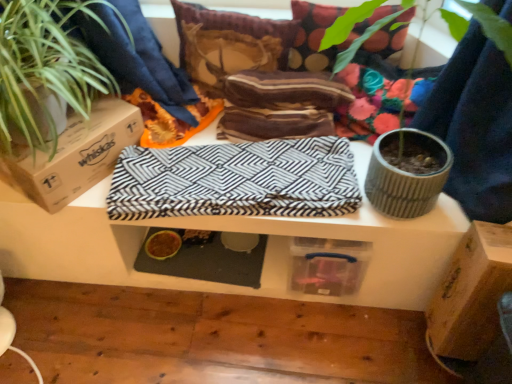
Question: Does green textured plant at upper right come in front of brown cardboard box at left, the second cardboard box ordered from the bottom?

Choices:
 (A) no
 (B) yes

Answer: (B)

Question: From a real-world perspective, is green textured plant at upper right positioned under brown cardboard box at left, the second cardboard box ordered from the bottom, based on gravity?

Choices:
 (A) no
 (B) yes

Answer: (A)

Question: From the image's perspective, is green textured plant at upper right above brown cardboard box at left, marked as the 1th cardboard box in a top-to-bottom arrangement?

Choices:
 (A) yes
 (B) no

Answer: (A)

Question: Is green textured plant at upper right not within brown cardboard box at left, the 2th cardboard box from the right?

Choices:
 (A) yes
 (B) no

Answer: (A)

Question: Is green textured plant at upper right positioned behind brown cardboard box at left, the second cardboard box ordered from the bottom?

Choices:
 (A) no
 (B) yes

Answer: (A)

Question: Considering the positions of point (228, 150) and point (176, 248), is point (228, 150) closer or farther from the camera than point (176, 248)?

Choices:
 (A) farther
 (B) closer

Answer: (B)

Question: Looking at their shapes, would you say black and white zigzag fabric at center is wider or thinner than yellow rubber food bowl at lower center?

Choices:
 (A) thin
 (B) wide

Answer: (B)

Question: Is black and white zigzag fabric at center taller or shorter than yellow rubber food bowl at lower center?

Choices:
 (A) short
 (B) tall

Answer: (B)

Question: Choose the correct answer: Is black and white zigzag fabric at center inside yellow rubber food bowl at lower center or outside it?

Choices:
 (A) inside
 (B) outside

Answer: (B)

Question: Is striped fabric pillow at upper center, acting as the first pillow starting from the left, inside the boundaries of brown cardboard box at lower right, acting as the second cardboard box starting from the top, or outside?

Choices:
 (A) outside
 (B) inside

Answer: (A)

Question: Considering the positions of point (219, 66) and point (456, 276), is point (219, 66) closer or farther from the camera than point (456, 276)?

Choices:
 (A) closer
 (B) farther

Answer: (B)

Question: Based on their sizes in the image, would you say striped fabric pillow at upper center, placed as the second pillow when sorted from right to left, is bigger or smaller than brown cardboard box at lower right, which is counted as the 2th cardboard box, starting from the left?

Choices:
 (A) big
 (B) small

Answer: (B)

Question: From a real-world perspective, is striped fabric pillow at upper center, acting as the first pillow starting from the left, above or below brown cardboard box at lower right, which is counted as the 2th cardboard box, starting from the left?

Choices:
 (A) above
 (B) below

Answer: (A)

Question: In terms of size, does green leafy plant at left appear bigger or smaller than brown cardboard box at lower right, which appears as the 1th cardboard box when ordered from the bottom?

Choices:
 (A) small
 (B) big

Answer: (B)

Question: Looking at their shapes, would you say green leafy plant at left is wider or thinner than brown cardboard box at lower right, which appears as the 1th cardboard box when ordered from the bottom?

Choices:
 (A) wide
 (B) thin

Answer: (A)